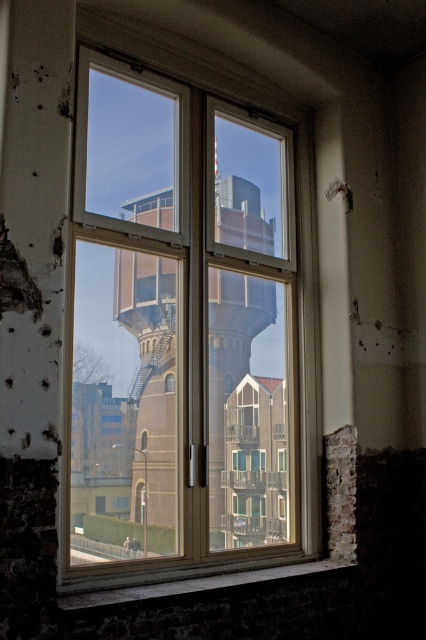
Does clear glass window at center appear on the left side of brown brick water tower at center?

Indeed, clear glass window at center is positioned on the left side of brown brick water tower at center.

At what (x,y) coordinates should I click in order to perform the action: click on clear glass window at center. Please return your answer as a coordinate pair (x, y). Looking at the image, I should click on pyautogui.click(x=183, y=332).